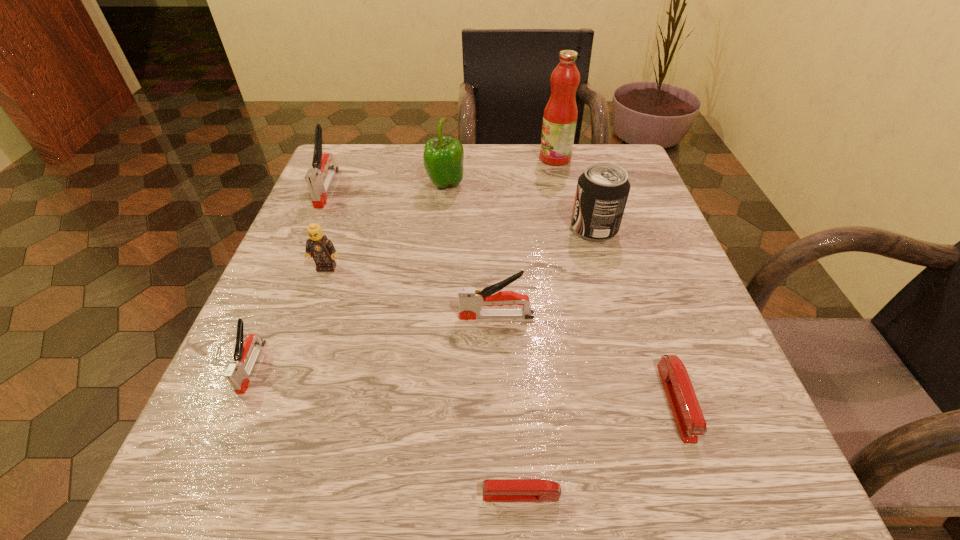
Locate an element on the screen. This screenshot has height=540, width=960. vacant area situated on the front label of the pink fruit juice is located at coordinates (465, 158).

Find the location of a particular element. free space located on the right of the bell pepper is located at coordinates (541, 185).

At what (x,y) coordinates should I click in order to perform the action: click on blank space located on the handle side of the farthest stapler. Please return your answer as a coordinate pair (x, y). The image size is (960, 540). Looking at the image, I should click on (305, 239).

Identify the location of free region located 0.360m on the front of the fourth farthest object. This screenshot has height=540, width=960. (650, 421).

Where is `free space located 0.220m on the handle side of the second biggest gray stapler`? free space located 0.220m on the handle side of the second biggest gray stapler is located at coordinates (324, 316).

The height and width of the screenshot is (540, 960). What are the coordinates of `free point located on the handle side of the second biggest gray stapler` in the screenshot? It's located at (428, 316).

The height and width of the screenshot is (540, 960). Identify the location of vacant space located on the handle side of the second biggest gray stapler. (255, 316).

At what (x,y) coordinates should I click in order to perform the action: click on vacant space located in front of the fifth nearest object. Please return your answer as a coordinate pair (x, y). The width and height of the screenshot is (960, 540). Looking at the image, I should click on (278, 405).

Identify the location of free space located 0.060m on the front-facing side of the rightmost stapler. [x=708, y=494].

I want to click on vacant space located on the front-facing side of the nearest object, so click(x=397, y=495).